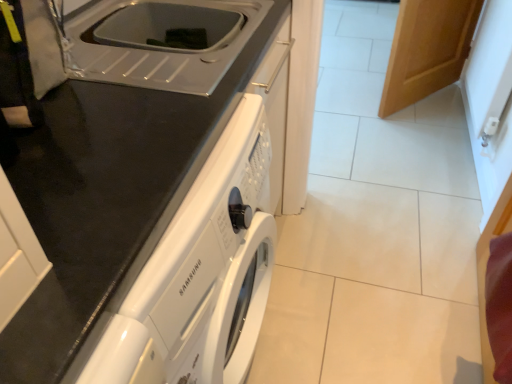
What is the approximate height of wooden door at upper right?

The height of wooden door at upper right is 26.98 inches.

Where is `wooden door at upper right`? wooden door at upper right is located at coordinates (426, 49).

Considering the relative sizes of white plastic sink at upper center and wooden door at upper right in the image provided, is white plastic sink at upper center bigger than wooden door at upper right?

No, white plastic sink at upper center is not bigger than wooden door at upper right.

Is white plastic sink at upper center located outside wooden door at upper right?

Absolutely, white plastic sink at upper center is external to wooden door at upper right.

Is white plastic sink at upper center next to wooden door at upper right and touching it?

No.

Considering the relative sizes of white plastic sink at upper center and wooden door at upper right in the image provided, is white plastic sink at upper center shorter than wooden door at upper right?

Yes, white plastic sink at upper center is shorter than wooden door at upper right.

Is white glossy washing machine at center inside or outside of white plastic sink at upper center?

Answer: white glossy washing machine at center lies outside white plastic sink at upper center.

Considering the positions of objects white glossy washing machine at center and white plastic sink at upper center in the image provided, who is in front, white glossy washing machine at center or white plastic sink at upper center?

Positioned in front is white glossy washing machine at center.

In the scene shown: Is white glossy washing machine at center looking in the opposite direction of white plastic sink at upper center?

That's not correct — white glossy washing machine at center is not looking away from white plastic sink at upper center.

Can you confirm if white glossy washing machine at center is bigger than wooden door at upper right?

Yes, white glossy washing machine at center is bigger than wooden door at upper right.

Considering the points (218, 65) and (389, 92), which point is behind, point (218, 65) or point (389, 92)?

Positioned behind is point (389, 92).

In terms of height, does white glossy washing machine at center look taller or shorter compared to wooden door at upper right?

In the image, white glossy washing machine at center appears to be taller than wooden door at upper right.

Is white glossy washing machine at center not close to wooden door at upper right?

Yes, white glossy washing machine at center and wooden door at upper right are located far from each other.

Which is more to the left, wooden door at upper right or white plastic sink at upper center?

From the viewer's perspective, white plastic sink at upper center appears more on the left side.

Is the depth of wooden door at upper right less than that of white plastic sink at upper center?

No.

Does wooden door at upper right have a greater height compared to white plastic sink at upper center?

Yes.

At what (x,y) coordinates should I click in order to perform the action: click on home appliance lying in front of the wooden door at upper right. Please return your answer as a coordinate pair (x, y). Image resolution: width=512 pixels, height=384 pixels. Looking at the image, I should click on (149, 200).

In the scene shown: Are wooden door at upper right and white glossy washing machine at center far apart?

Absolutely, wooden door at upper right is distant from white glossy washing machine at center.

Considering the sizes of wooden door at upper right and white glossy washing machine at center in the image, is wooden door at upper right wider or thinner than white glossy washing machine at center?

In the image, wooden door at upper right appears to be more narrow than white glossy washing machine at center.

From the image's perspective, is white plastic sink at upper center over white glossy washing machine at center?

Yes, from the image's perspective, white plastic sink at upper center is over white glossy washing machine at center.

From the picture: What's the angular difference between white plastic sink at upper center and white glossy washing machine at center's facing directions?

The angle between the facing direction of white plastic sink at upper center and the facing direction of white glossy washing machine at center is 1.42 degrees.

Which of these two, white plastic sink at upper center or white glossy washing machine at center, is thinner?

white plastic sink at upper center is thinner.

Identify the location of cabinetry behind the white plastic sink at upper center. (426, 49).

The image size is (512, 384). Find the location of `home appliance below the white plastic sink at upper center (from the image's perspective)`. home appliance below the white plastic sink at upper center (from the image's perspective) is located at coordinates (149, 200).

Looking at the image, which one is located further to white glossy washing machine at center, white plastic sink at upper center or wooden door at upper right?

Among the two, wooden door at upper right is located further to white glossy washing machine at center.

When comparing their distances from white glossy washing machine at center, does wooden door at upper right or white plastic sink at upper center seem closer?

white plastic sink at upper center is closer to white glossy washing machine at center.

Which object lies nearer to the anchor point wooden door at upper right, white glossy washing machine at center or white plastic sink at upper center?

white plastic sink at upper center is closer to wooden door at upper right.

Which object lies nearer to the anchor point white plastic sink at upper center, white glossy washing machine at center or wooden door at upper right?

Among the two, white glossy washing machine at center is located nearer to white plastic sink at upper center.

Estimate the real-world distances between objects in this image. Which object is closer to white plastic sink at upper center, wooden door at upper right or white glossy washing machine at center?

white glossy washing machine at center lies closer to white plastic sink at upper center than the other object.

Which object lies further to the anchor point wooden door at upper right, white plastic sink at upper center or white glossy washing machine at center?

The object further to wooden door at upper right is white glossy washing machine at center.

You are a GUI agent. You are given a task and a screenshot of the screen. Output one action in this format:
    pyautogui.click(x=<x>, y=<y>)
    Task: Click on the sink situated between white glossy washing machine at center and wooden door at upper right from left to right
    The image size is (512, 384).
    Given the screenshot: What is the action you would take?
    pyautogui.click(x=158, y=39)